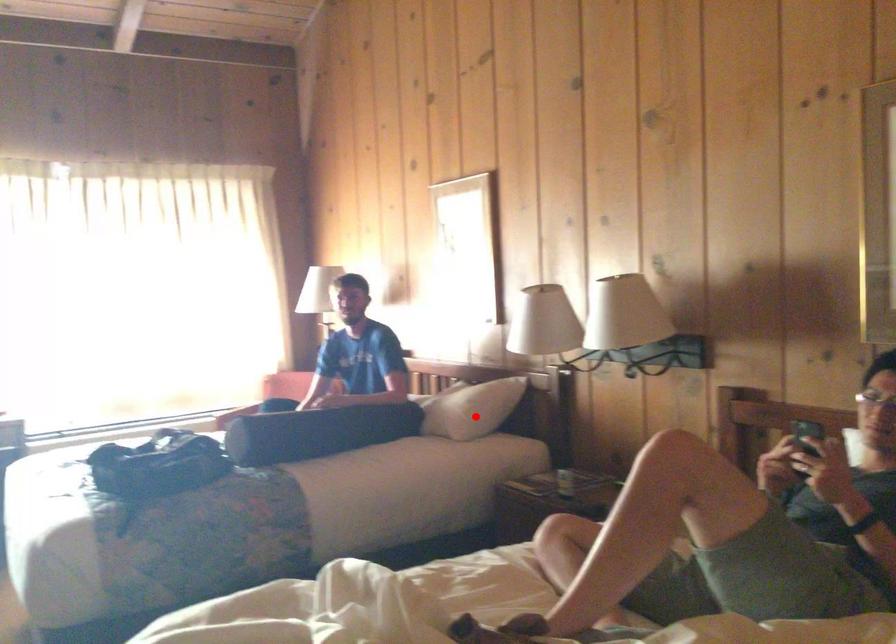
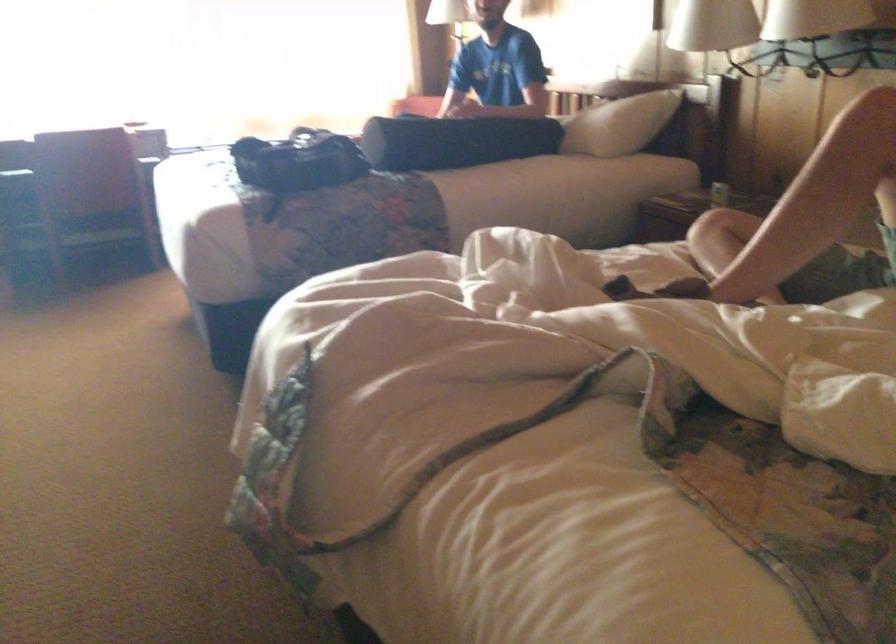
Find the pixel in the second image that matches the highlighted location in the first image.

(618, 124)